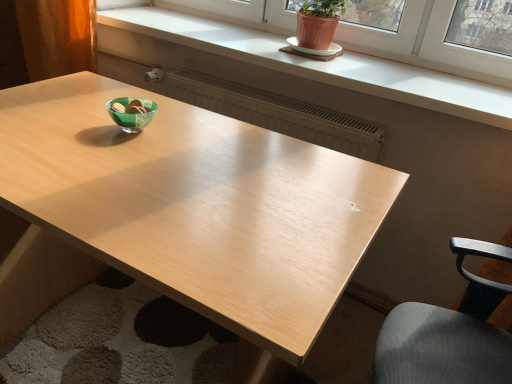
Question: From the image's perspective, is matte white window sill at upper center on matte brown curtain at left?

Choices:
 (A) no
 (B) yes

Answer: (A)

Question: Is matte white window sill at upper center with matte brown curtain at left?

Choices:
 (A) yes
 (B) no

Answer: (B)

Question: Is matte white window sill at upper center smaller than matte brown curtain at left?

Choices:
 (A) no
 (B) yes

Answer: (A)

Question: Is matte white window sill at upper center facing towards matte brown curtain at left?

Choices:
 (A) yes
 (B) no

Answer: (B)

Question: Can you confirm if matte white window sill at upper center is thinner than matte brown curtain at left?

Choices:
 (A) yes
 (B) no

Answer: (B)

Question: Is matte brown curtain at left at the back of matte white window sill at upper center?

Choices:
 (A) yes
 (B) no

Answer: (B)

Question: Is matte white window sill at upper center positioned beyond the bounds of white ceramic saucer at upper center?

Choices:
 (A) yes
 (B) no

Answer: (A)

Question: Does matte white window sill at upper center have a lesser width compared to white ceramic saucer at upper center?

Choices:
 (A) yes
 (B) no

Answer: (B)

Question: Is white ceramic saucer at upper center located within matte white window sill at upper center?

Choices:
 (A) yes
 (B) no

Answer: (B)

Question: From a real-world perspective, is matte white window sill at upper center located higher than white ceramic saucer at upper center?

Choices:
 (A) no
 (B) yes

Answer: (A)

Question: From the image's perspective, is matte white window sill at upper center beneath white ceramic saucer at upper center?

Choices:
 (A) yes
 (B) no

Answer: (A)

Question: Does matte white window sill at upper center have a smaller size compared to white ceramic saucer at upper center?

Choices:
 (A) no
 (B) yes

Answer: (A)

Question: From a real-world perspective, is matte white window sill at upper center under light wood table at center?

Choices:
 (A) yes
 (B) no

Answer: (B)